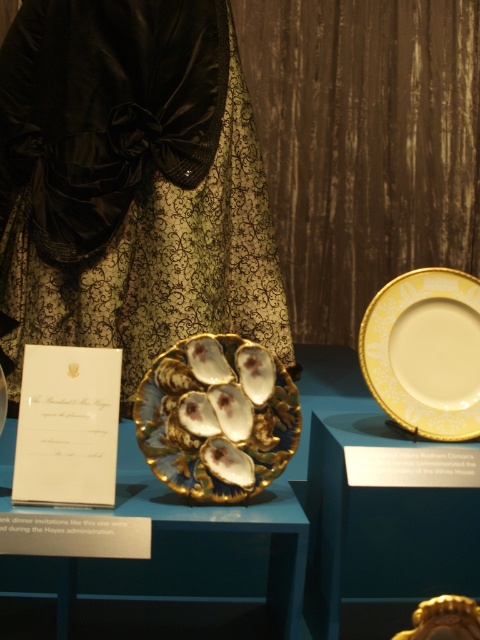
Question: Which of the following is the closest to the observer?

Choices:
 (A) gold metallic oyster shell at center
 (B) black satin dress at center
 (C) gold/white porcelain plate at upper right

Answer: (A)

Question: Estimate the real-world distances between objects in this image. Which object is closer to the black satin dress at center?

Choices:
 (A) gold/white porcelain plate at upper right
 (B) gold metallic oyster shell at center

Answer: (B)

Question: In this image, where is black satin dress at center located relative to gold metallic oyster shell at center?

Choices:
 (A) above
 (B) below

Answer: (A)

Question: Does black satin dress at center have a larger size compared to gold metallic oyster shell at center?

Choices:
 (A) no
 (B) yes

Answer: (B)

Question: Which of the following is the farthest from the observer?

Choices:
 (A) (264, 445)
 (B) (96, 120)

Answer: (B)

Question: Can you confirm if black satin dress at center is thinner than gold/white porcelain plate at upper right?

Choices:
 (A) yes
 (B) no

Answer: (B)